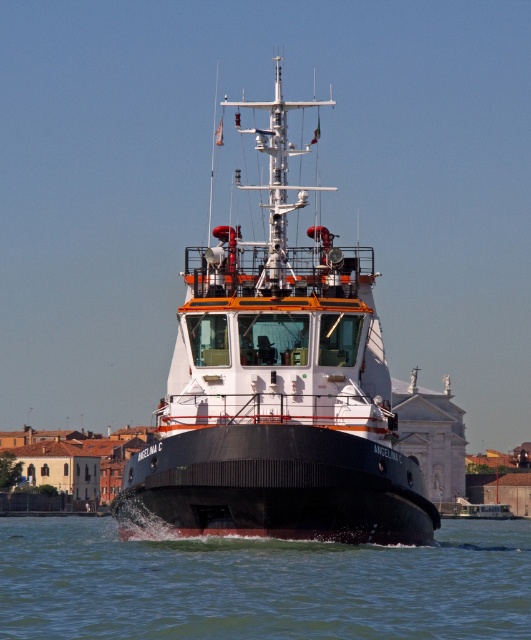
Is the position of matte white ship at center less distant than that of brown matte water at lower center?

No, it is behind brown matte water at lower center.

Can you confirm if matte white ship at center is positioned to the right of brown matte water at lower center?

Incorrect, matte white ship at center is not on the right side of brown matte water at lower center.

Who is more forward, (328, 410) or (226, 564)?

Point (226, 564) is more forward.

This screenshot has height=640, width=531. In order to click on matte white ship at center in this screenshot , I will do `click(278, 390)`.